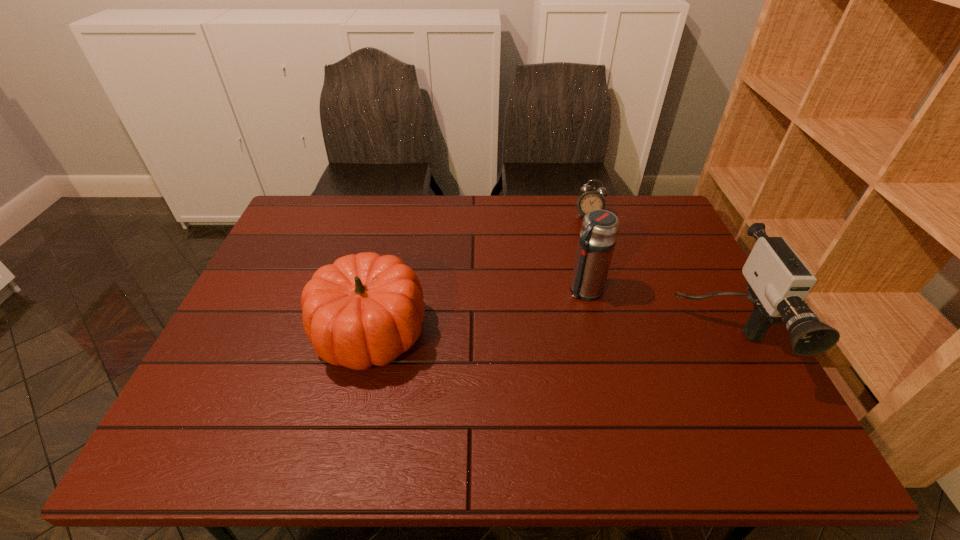
Identify the location of unoccupied area between the thermos bottle and the camcorder. The width and height of the screenshot is (960, 540). (654, 313).

Where is `empty space that is in between the second shortest object and the camcorder`? The height and width of the screenshot is (540, 960). empty space that is in between the second shortest object and the camcorder is located at coordinates (546, 334).

Locate an element on the screen. The width and height of the screenshot is (960, 540). vacant area between the thermos bottle and the pumpkin is located at coordinates (477, 310).

You are a GUI agent. You are given a task and a screenshot of the screen. Output one action in this format:
    pyautogui.click(x=<x>, y=<y>)
    Task: Click on the free space between the rightmost object and the alarm clock
    
    Given the screenshot: What is the action you would take?
    pyautogui.click(x=656, y=276)

The height and width of the screenshot is (540, 960). Find the location of `vacant area between the alarm clock and the leftmost object`. vacant area between the alarm clock and the leftmost object is located at coordinates (479, 274).

Locate which object ranks in proximity to the alarm clock. Please provide its 2D coordinates. Your answer should be formatted as a tuple, i.e. [(x, y)], where the tuple contains the x and y coordinates of a point satisfying the conditions above.

[(599, 230)]

Locate an element on the screen. This screenshot has height=540, width=960. object that can be found as the second closest to the rightmost object is located at coordinates (591, 199).